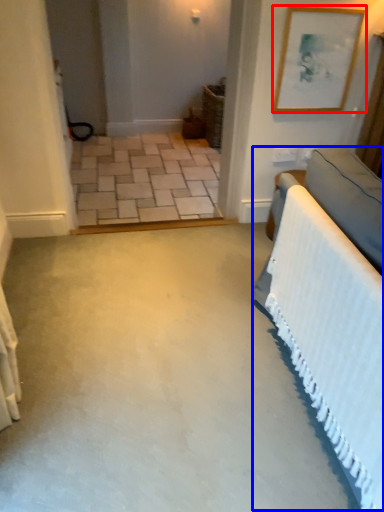
Question: Which object is further to the camera taking this photo, picture frame (highlighted by a red box) or bed (highlighted by a blue box)?

Choices:
 (A) picture frame
 (B) bed

Answer: (A)